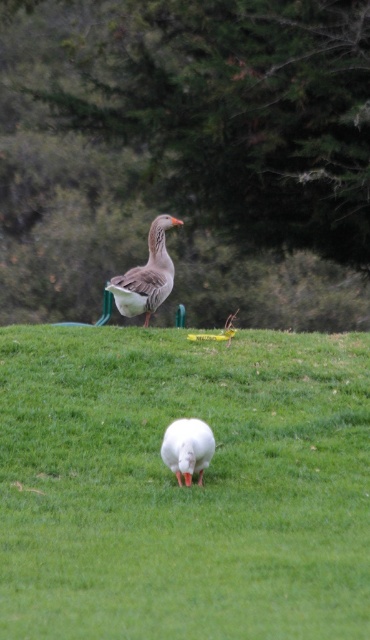
You are a birdwatcher trying to identify the taller duck between the gray matte duck at center and the white matte duck at center. Based on the scene, which duck is taller?

The gray matte duck at center is much taller than the white matte duck at center, so the taller duck is the gray matte duck at center.

You are a drone operator trying to capture a photo of the two geese in the scene. The white grass at center is at point 0.761, 0.497 in the image. Where should you position your drone to ensure both geese are in frame?

To capture both geese in frame, position the drone so that the white grass at center remains at point [183,486], ensuring the camera angle includes the foreground white goose and the background grayish brown goose on the hill.